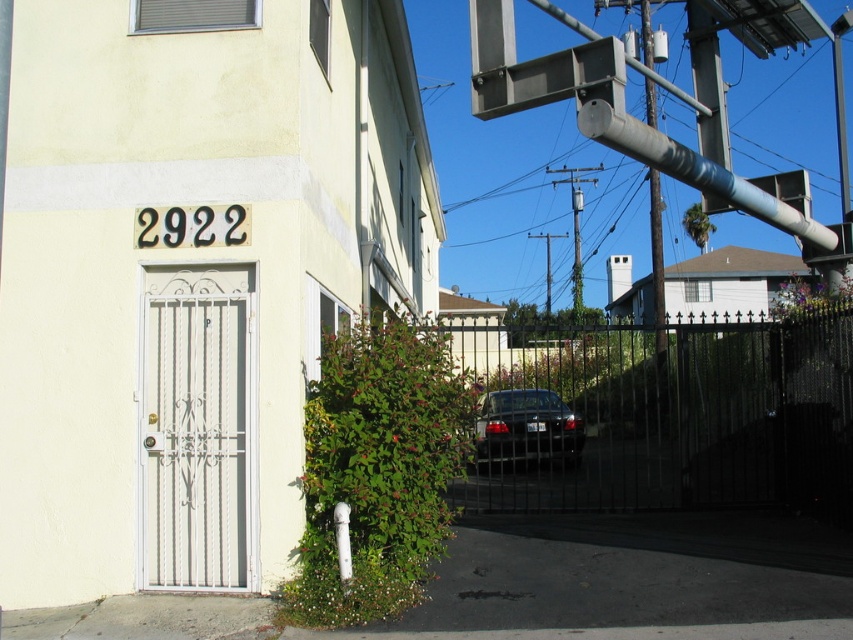
Question: From the image, what is the correct spatial relationship of black wrought iron gate at center in relation to shiny black sedan at center?

Choices:
 (A) left
 (B) right

Answer: (B)

Question: Can you confirm if black wrought iron gate at center is positioned above shiny black sedan at center?

Choices:
 (A) no
 (B) yes

Answer: (B)

Question: Which object appears farthest from the camera in this image?

Choices:
 (A) black wrought iron gate at center
 (B) shiny black sedan at center

Answer: (B)

Question: Can you confirm if black wrought iron gate at center is smaller than shiny black sedan at center?

Choices:
 (A) no
 (B) yes

Answer: (A)